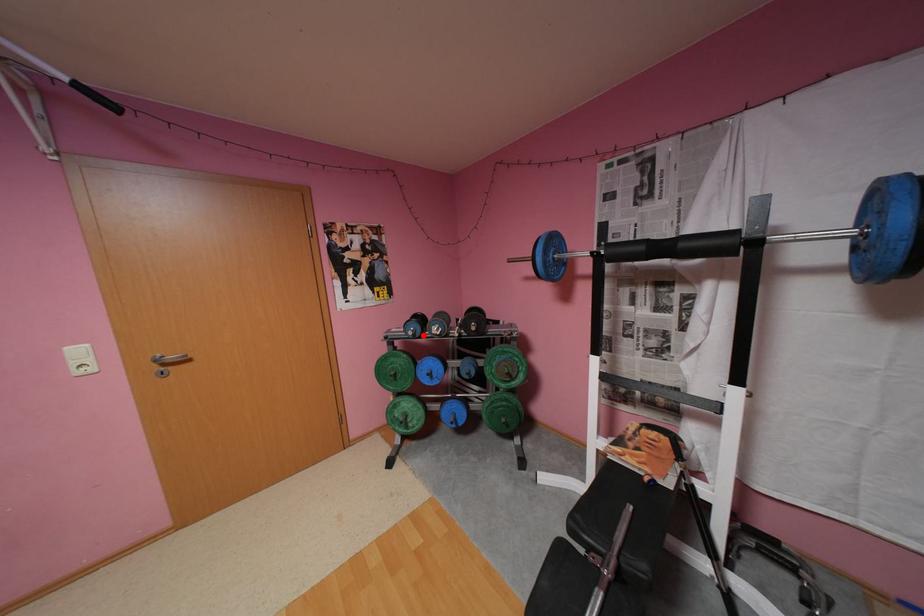
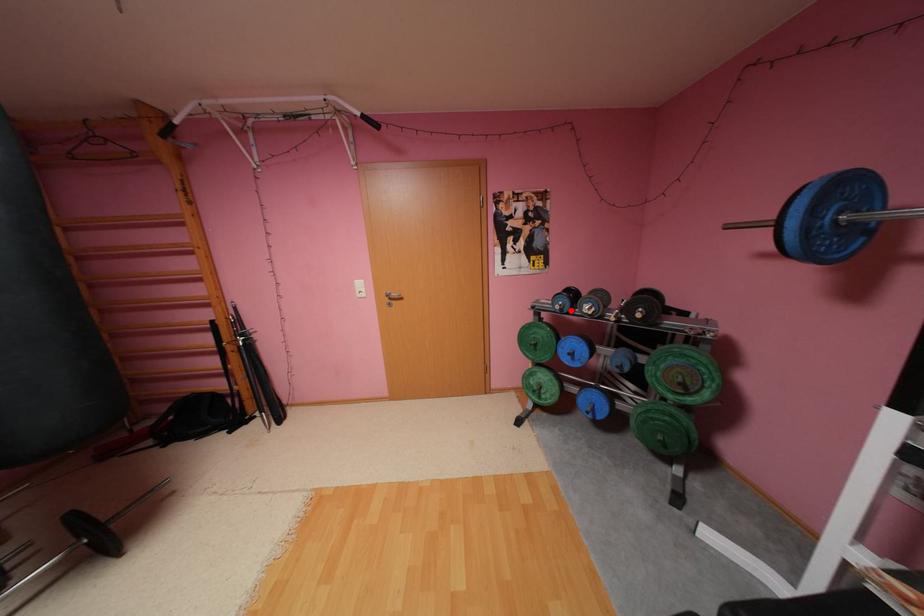
I am providing you with two images of the same scene from different viewpoints. A red point is marked on the first image and another point is marked on the second image. Is the marked point in image1 the same physical position as the marked point in image2?

Yes